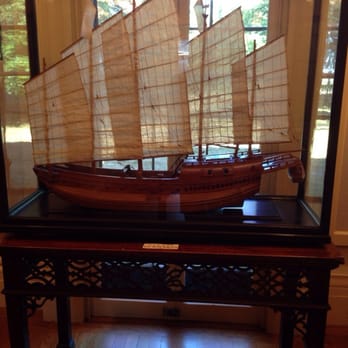
Image resolution: width=348 pixels, height=348 pixels. I want to click on enclosed glass case, so click(x=302, y=204).